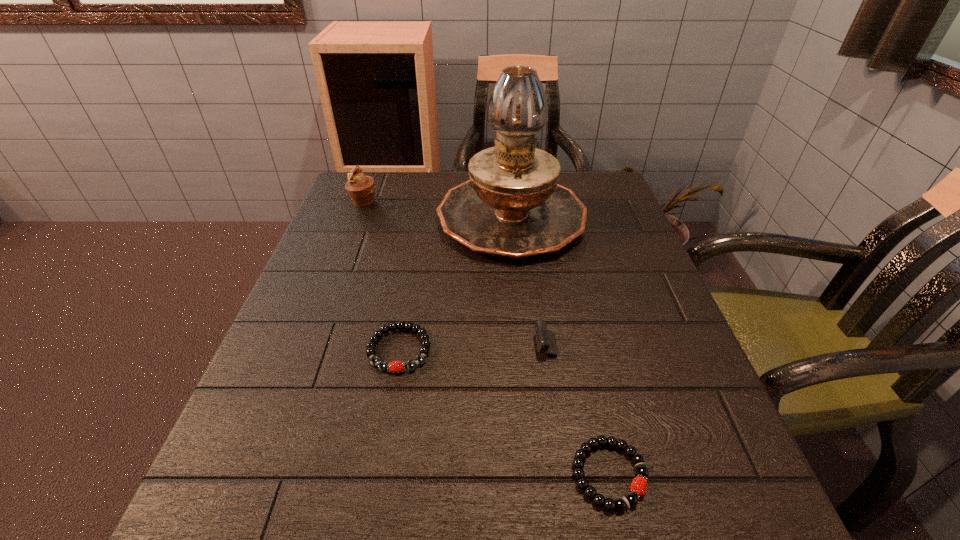
Identify the location of free region located on the front-facing side of the third tallest object. (454, 343).

Identify the location of vacant area located on the front-facing side of the third tallest object. (492, 343).

Where is `free space located 0.320m on the back of the farther bracelet`? This screenshot has width=960, height=540. free space located 0.320m on the back of the farther bracelet is located at coordinates (420, 230).

At what (x,y) coordinates should I click in order to perform the action: click on vacant space located 0.310m on the back of the nearer bracelet. Please return your answer as a coordinate pair (x, y). Image resolution: width=960 pixels, height=540 pixels. Looking at the image, I should click on (570, 298).

Identify the location of oil lamp that is at the far edge. The height and width of the screenshot is (540, 960). (512, 207).

I want to click on muffin at the far edge, so click(361, 189).

Image resolution: width=960 pixels, height=540 pixels. Find the location of `object present at the near edge`. object present at the near edge is located at coordinates (620, 504).

Locate an element on the screen. Image resolution: width=960 pixels, height=540 pixels. object that is positioned at the left edge is located at coordinates (361, 189).

Locate an element on the screen. oil lamp located at the right edge is located at coordinates [512, 207].

This screenshot has height=540, width=960. I want to click on webcam present at the right edge, so click(546, 340).